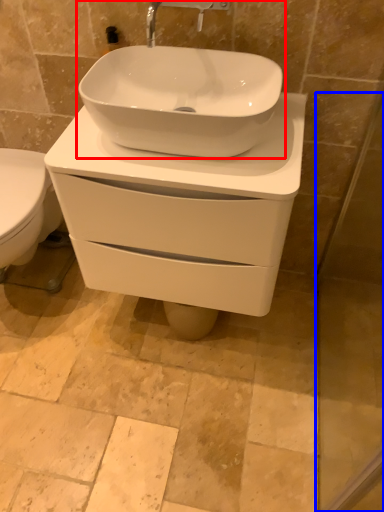
Question: Which object appears closest to the camera in this image, sink (highlighted by a red box) or screen door (highlighted by a blue box)?

Choices:
 (A) sink
 (B) screen door

Answer: (B)